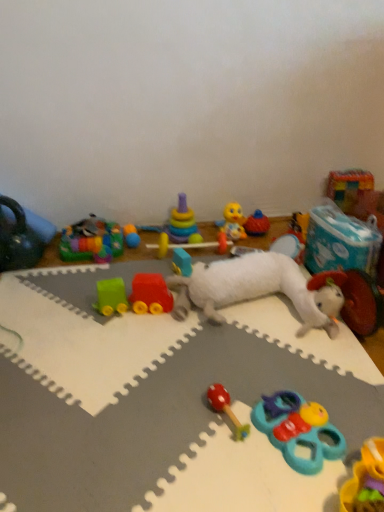
Question: Is the position of matte black kettlebell at left, placed as the 15th toy when sorted from right to left, less distant than that of multicolored plastic rainbow at upper left, positioned as the 14th toy in right-to-left order?

Choices:
 (A) no
 (B) yes

Answer: (B)

Question: Does matte black kettlebell at left, the first toy from the left, have a greater height compared to multicolored plastic rainbow at upper left, positioned as the 14th toy in right-to-left order?

Choices:
 (A) no
 (B) yes

Answer: (B)

Question: Considering the relative sizes of matte black kettlebell at left, placed as the 15th toy when sorted from right to left, and multicolored plastic rainbow at upper left, the 2th toy when ordered from left to right, in the image provided, is matte black kettlebell at left, placed as the 15th toy when sorted from right to left, thinner than multicolored plastic rainbow at upper left, the 2th toy when ordered from left to right,?

Choices:
 (A) no
 (B) yes

Answer: (B)

Question: Does matte black kettlebell at left, the first toy from the left, touch multicolored plastic rainbow at upper left, positioned as the 14th toy in right-to-left order?

Choices:
 (A) no
 (B) yes

Answer: (A)

Question: Is matte black kettlebell at left, the first toy from the left, not within multicolored plastic rainbow at upper left, positioned as the 14th toy in right-to-left order?

Choices:
 (A) yes
 (B) no

Answer: (A)

Question: Considering the positions of yellow rubber duck at center, placed as the tenth toy when sorted from left to right, and white plush toy at center, the eighth toy viewed from the left, in the image, is yellow rubber duck at center, placed as the tenth toy when sorted from left to right, taller or shorter than white plush toy at center, the eighth toy viewed from the left,?

Choices:
 (A) tall
 (B) short

Answer: (A)

Question: Is yellow rubber duck at center, placed as the tenth toy when sorted from left to right, to the left or to the right of white plush toy at center, the 8th toy from the right, in the image?

Choices:
 (A) right
 (B) left

Answer: (A)

Question: Is yellow rubber duck at center, which is counted as the sixth toy, starting from the right, wider or thinner than white plush toy at center, the 8th toy from the right?

Choices:
 (A) wide
 (B) thin

Answer: (B)

Question: Is yellow rubber duck at center, which is counted as the sixth toy, starting from the right, inside or outside of white plush toy at center, the 8th toy from the right?

Choices:
 (A) inside
 (B) outside

Answer: (B)

Question: From their relative heights in the image, would you say matte black kettlebell at left, the first toy from the left, is taller or shorter than multicolored plastic rainbow at upper left, the 2th toy when ordered from left to right?

Choices:
 (A) tall
 (B) short

Answer: (A)

Question: Is matte black kettlebell at left, the first toy from the left, in front of or behind multicolored plastic rainbow at upper left, the 2th toy when ordered from left to right, in the image?

Choices:
 (A) behind
 (B) front

Answer: (B)

Question: From the image's perspective, relative to multicolored plastic rainbow at upper left, positioned as the 14th toy in right-to-left order, is matte black kettlebell at left, placed as the 15th toy when sorted from right to left, above or below?

Choices:
 (A) below
 (B) above

Answer: (B)

Question: Based on their sizes in the image, would you say matte black kettlebell at left, placed as the 15th toy when sorted from right to left, is bigger or smaller than multicolored plastic rainbow at upper left, the 2th toy when ordered from left to right?

Choices:
 (A) small
 (B) big

Answer: (B)

Question: Is point (221, 237) closer or farther from the camera than point (173, 241)?

Choices:
 (A) closer
 (B) farther

Answer: (A)

Question: From the image's perspective, relative to stacked plastic rings at center, which is the 12th toy from right to left, is rubberized plastic toy at center, which is the tenth toy in right-to-left order, above or below?

Choices:
 (A) above
 (B) below

Answer: (B)